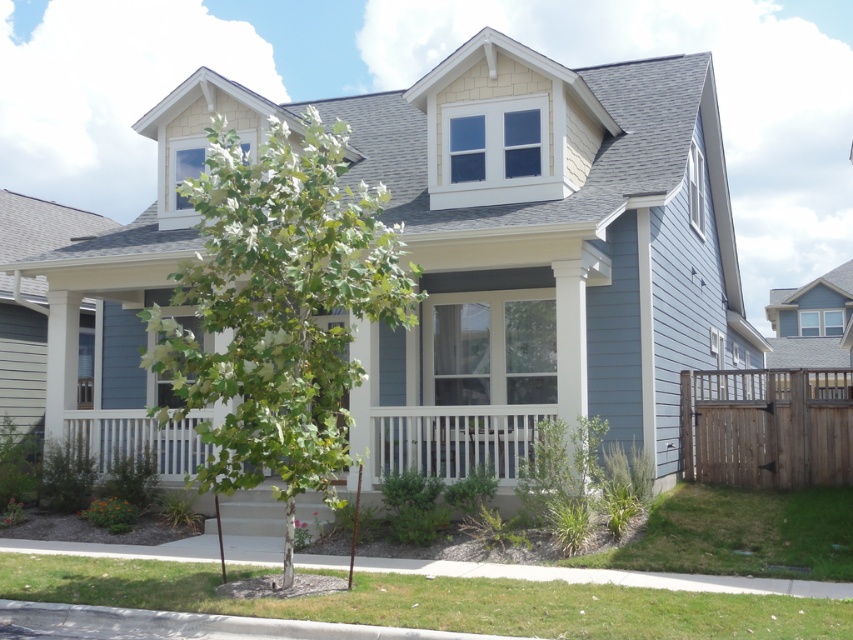
In the scene shown: You are a gardener planning to plant a new tree that requires 8 meters of space between it and any fence. Based on the scene, can you plant the green leafy tree at center near the brown wooden fence at right without violating the space requirement?

The green leafy tree at center and brown wooden fence at right are 7.65 meters apart from each other. Since 7.65 meters is less than the required 8 meters, planting the tree there would violate the space requirement.

You are a landscape architect designing a garden for this house. You need to place a new bench that requires at least 3 meters of space around it. Given the green leafy tree at center and the brown wooden fence at right, which object should you consider for placement to ensure enough space?

The green leafy tree at center has a larger size compared to the brown wooden fence at right, so placing the bench near the brown wooden fence at right would provide more space around it for the required 3 meters.